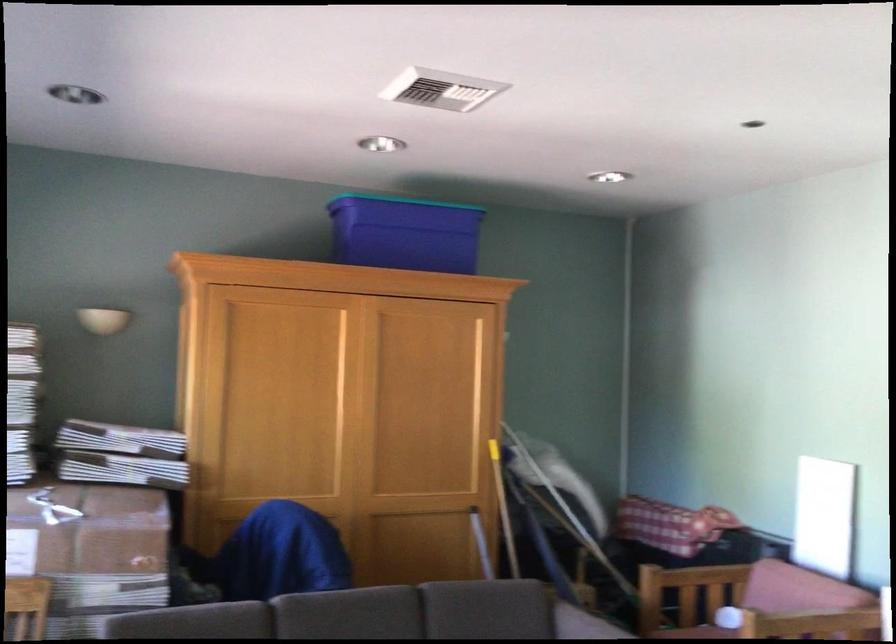
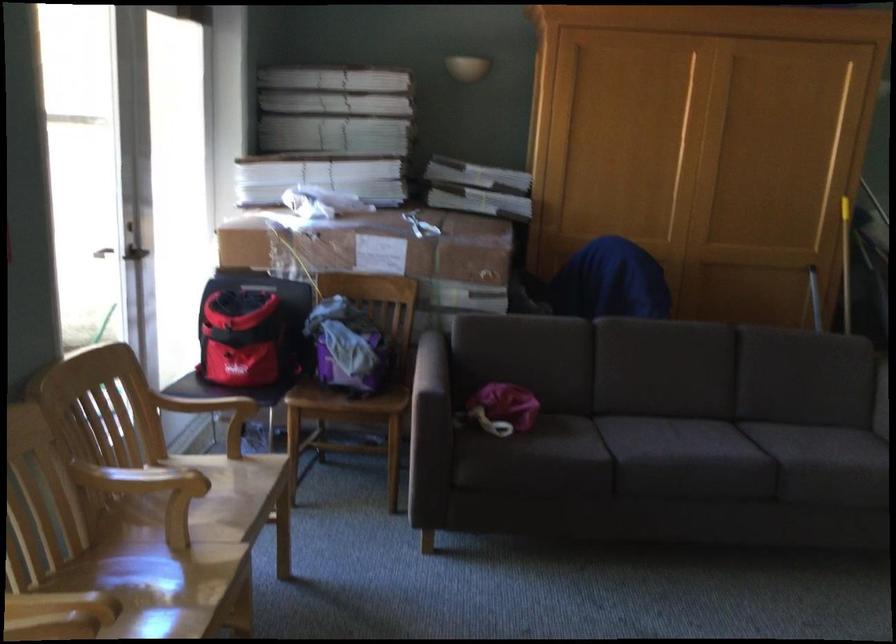
First-person continuous shooting, in which direction is the camera rotating?

The rotation direction of the camera is left-down.